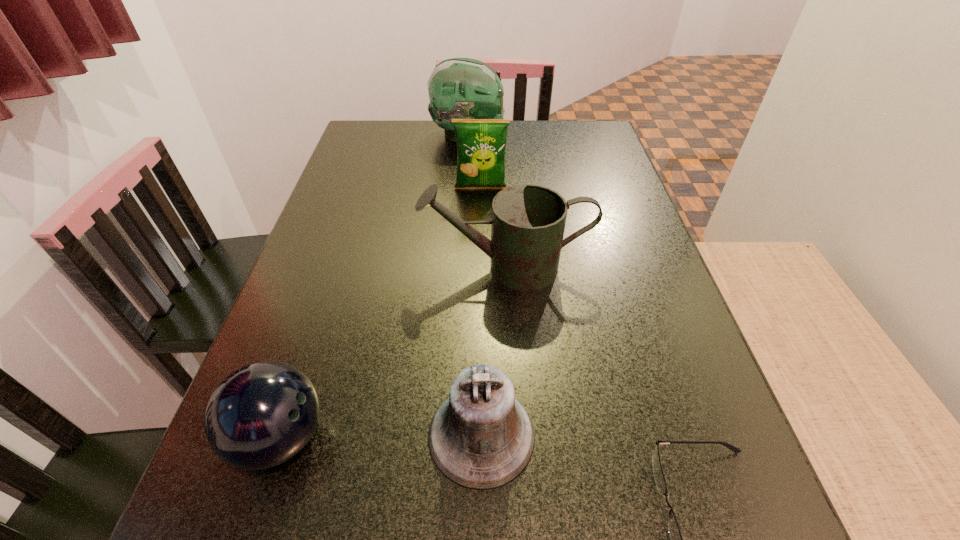
The height and width of the screenshot is (540, 960). Find the location of `unoccupied area between the bowling ball and the football helmet`. unoccupied area between the bowling ball and the football helmet is located at coordinates (374, 286).

Identify the location of free space that is in between the bell and the crisp (potato chip). The height and width of the screenshot is (540, 960). (481, 312).

Where is `blank region between the bell and the watering can`? The image size is (960, 540). blank region between the bell and the watering can is located at coordinates (493, 351).

Where is `free space that is in between the bell and the watering can`? This screenshot has width=960, height=540. free space that is in between the bell and the watering can is located at coordinates (493, 351).

Where is `vacant area that lies between the farthest object and the leftmost object`? vacant area that lies between the farthest object and the leftmost object is located at coordinates (374, 286).

Identify which object is the closest to the farthest object. Please provide its 2D coordinates. Your answer should be formatted as a tuple, i.e. [(x, y)], where the tuple contains the x and y coordinates of a point satisfying the conditions above.

[(481, 143)]

Where is `object that stands as the fourth closest to the spectacles`? The width and height of the screenshot is (960, 540). object that stands as the fourth closest to the spectacles is located at coordinates (481, 143).

You are a GUI agent. You are given a task and a screenshot of the screen. Output one action in this format:
    pyautogui.click(x=<x>, y=<y>)
    Task: Click on the free region that satisfies the following two spatial constraints: 1. on the front-facing side of the crisp (potato chip); 2. on the side of the bowling ball with the finger holes
    Image resolution: width=960 pixels, height=540 pixels.
    Given the screenshot: What is the action you would take?
    pyautogui.click(x=481, y=437)

This screenshot has width=960, height=540. Identify the location of free space in the image that satisfies the following two spatial constraints: 1. on the front-facing side of the crisp (potato chip); 2. on the left side of the bell. (481, 435).